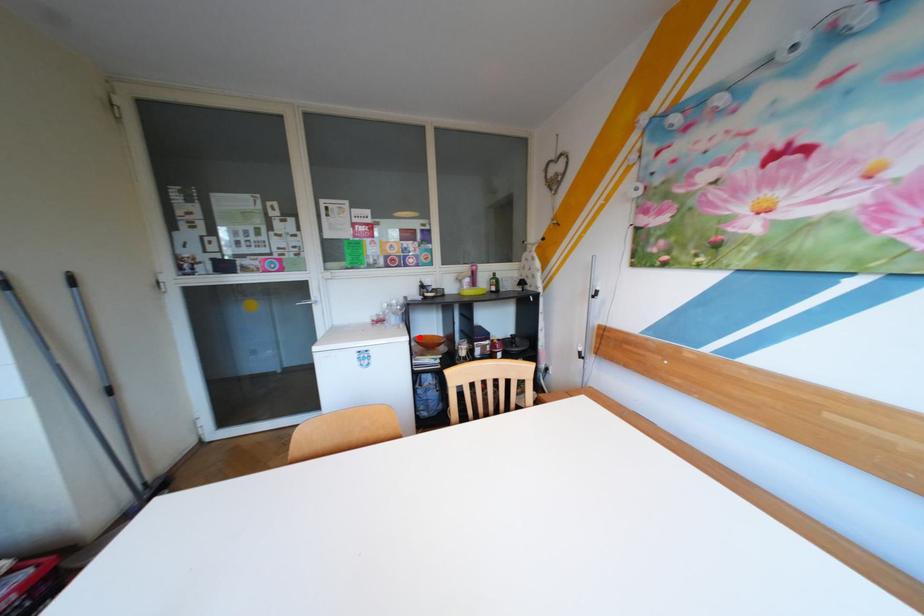
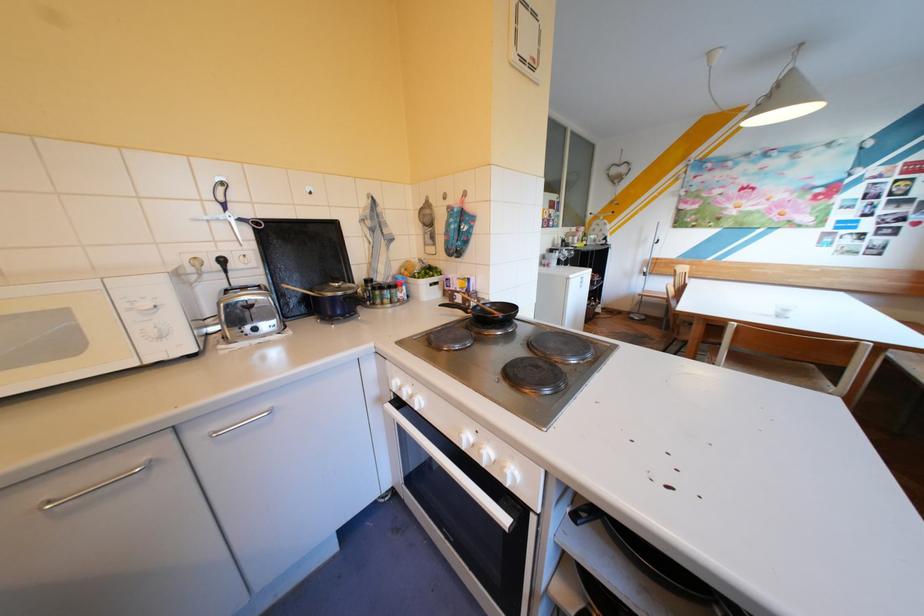
Question: I am providing you with two images of the same scene from different viewpoints. A red point is marked on the first image. Can you still see the location of the red point in image 2?

Choices:
 (A) Yes
 (B) No

Answer: (B)